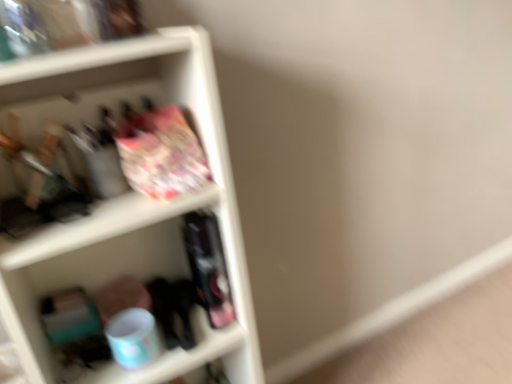
Question: Should I look upward or downward to see matte plastic bag at upper left?

Choices:
 (A) up
 (B) down

Answer: (B)